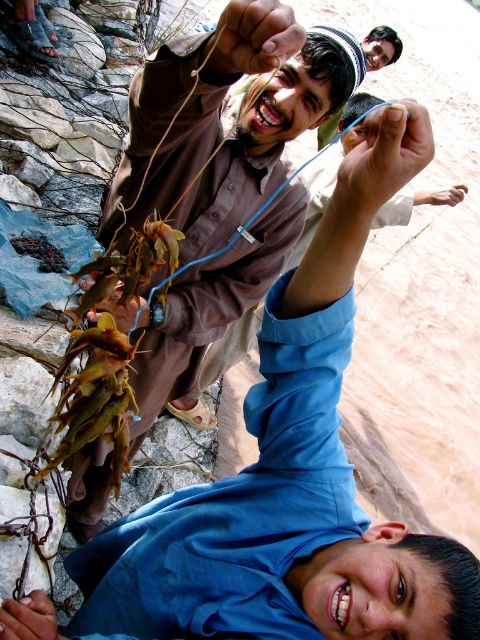
Does blue wire at center appear on the left side of matte blue wire at center?

In fact, blue wire at center is to the right of matte blue wire at center.

Find the location of a particular element. This screenshot has height=640, width=480. blue wire at center is located at coordinates (392, 145).

Where is `blue wire at center`? blue wire at center is located at coordinates (392, 145).

Who is more distant from viewer, (243,49) or (393,33)?

Point (393,33)

Can you confirm if smooth skin hand at upper center is bigger than blue fabric cap at upper center?

Incorrect, smooth skin hand at upper center is not larger than blue fabric cap at upper center.

This screenshot has height=640, width=480. In order to click on smooth skin hand at upper center in this screenshot , I will do `click(254, 36)`.

Is blue wire at center further to camera compared to blue fabric cap at upper center?

No, it is not.

Is point (410, 120) farther from camera compared to point (339, 29)?

No, it is not.

Who is more distant from viewer, (408, 112) or (350, 48)?

The point (350, 48) is more distant.

Find the location of a particular element. This screenshot has height=640, width=480. blue wire at center is located at coordinates (392, 145).